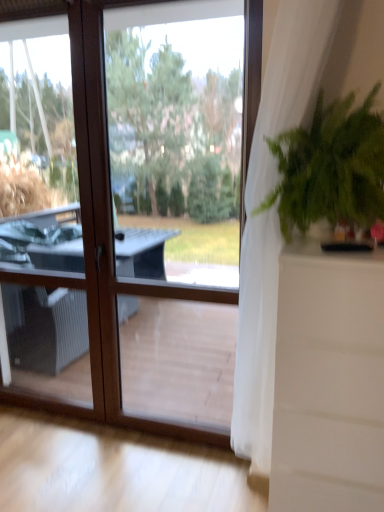
Question: Is transparent glass window at center in contact with green leafy plant at right?

Choices:
 (A) no
 (B) yes

Answer: (A)

Question: Considering the relative positions of transparent glass window at center and green leafy plant at right in the image provided, is transparent glass window at center in front of green leafy plant at right?

Choices:
 (A) no
 (B) yes

Answer: (A)

Question: Is transparent glass window at center far away from green leafy plant at right?

Choices:
 (A) yes
 (B) no

Answer: (B)

Question: Is transparent glass window at center at the right side of green leafy plant at right?

Choices:
 (A) no
 (B) yes

Answer: (A)

Question: Can you confirm if transparent glass window at center is thinner than green leafy plant at right?

Choices:
 (A) no
 (B) yes

Answer: (B)

Question: Would you say transparent glass window at center is outside green leafy plant at right?

Choices:
 (A) no
 (B) yes

Answer: (B)

Question: Does white sheer curtain at right appear on the left side of transparent glass window at center?

Choices:
 (A) no
 (B) yes

Answer: (A)

Question: Is white sheer curtain at right looking in the opposite direction of transparent glass window at center?

Choices:
 (A) yes
 (B) no

Answer: (B)

Question: Considering the relative sizes of white sheer curtain at right and transparent glass window at center in the image provided, is white sheer curtain at right thinner than transparent glass window at center?

Choices:
 (A) no
 (B) yes

Answer: (A)

Question: Is white sheer curtain at right further to the viewer compared to transparent glass window at center?

Choices:
 (A) no
 (B) yes

Answer: (A)

Question: Are white sheer curtain at right and transparent glass window at center far apart?

Choices:
 (A) no
 (B) yes

Answer: (A)

Question: Can you confirm if white sheer curtain at right is shorter than transparent glass window at center?

Choices:
 (A) yes
 (B) no

Answer: (A)

Question: Can white sheer curtain at right be found inside transparent glass window at center?

Choices:
 (A) yes
 (B) no

Answer: (B)